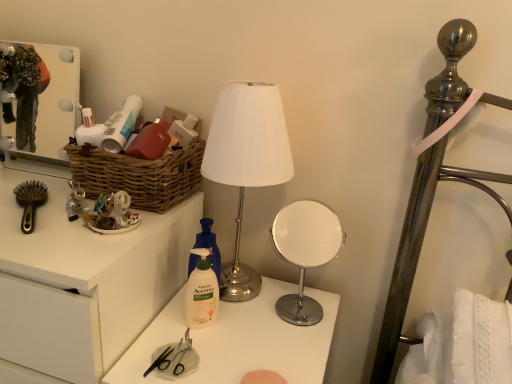
Where is `free space in front of brown woven basket at left`? This screenshot has height=384, width=512. free space in front of brown woven basket at left is located at coordinates (81, 235).